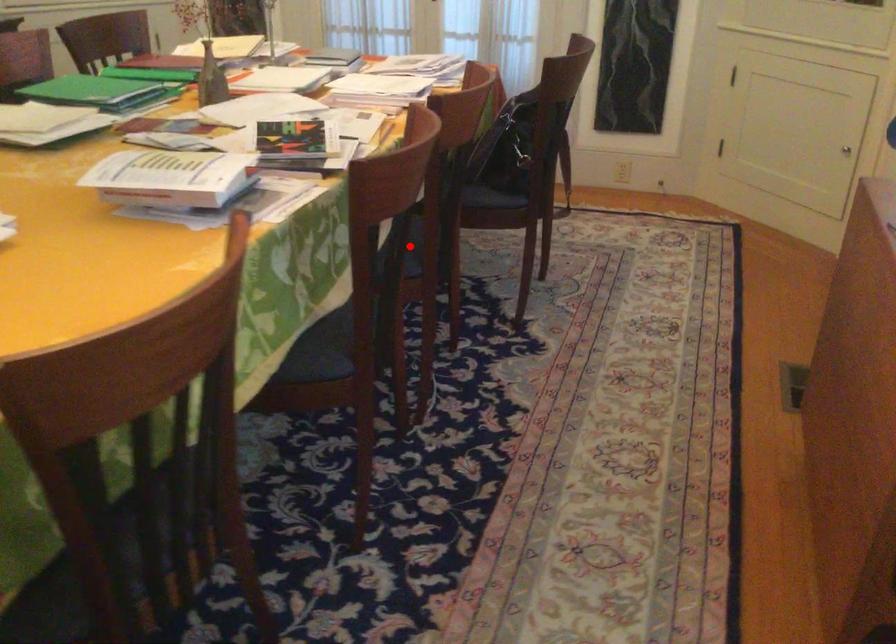
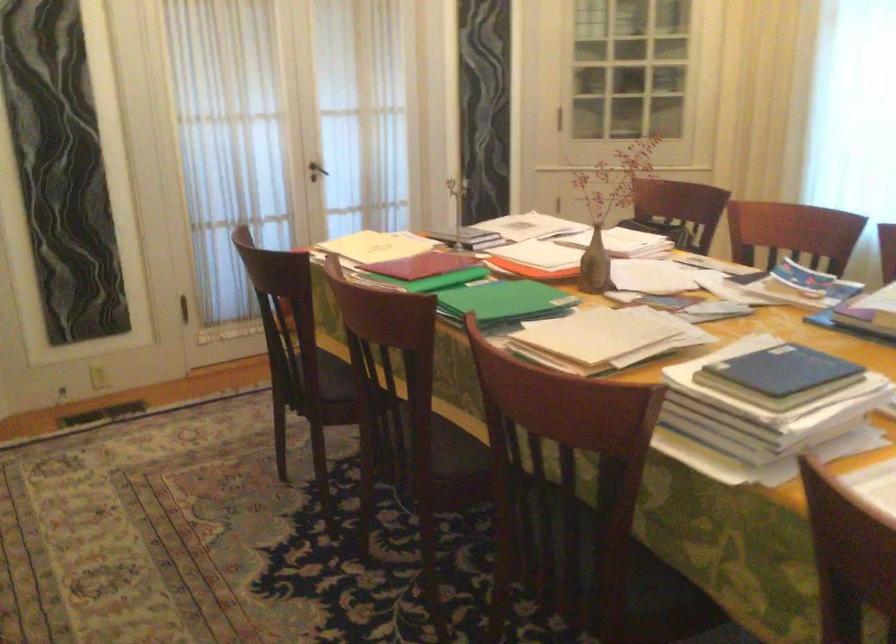
Question: I am providing you with two images of the same scene from different viewpoints. A red point is marked on the first image. Is the red point's position out of view in image 2?

Choices:
 (A) Yes
 (B) No

Answer: (A)